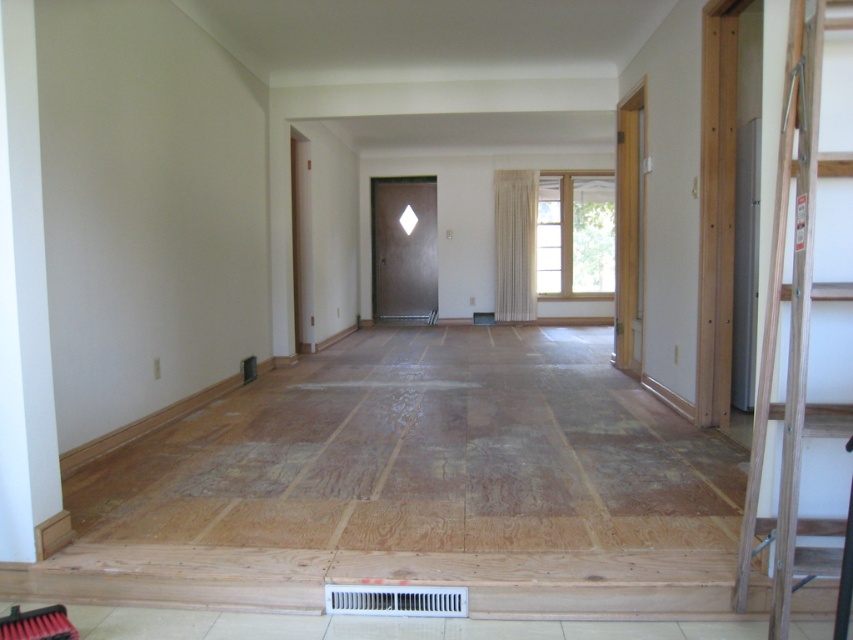
You are a construction worker who needs to move a heavy tool from the wooden ladder at right to the matte dark brown door at center. The tool requires a clear path that is at least 8 meters long. Can you move the tool along the path between them?

The wooden ladder at right and matte dark brown door at center are 9.14 meters apart, so yes, the tool can be moved along the path between them since the distance is sufficient.

You are a delivery person who needs to place a large package in this room. The wooden ladder at right and the white plastic air conditioner at lower center are in the way. Which object should you move first to create space?

You should move the wooden ladder at right first because it is bigger than the white plastic air conditioner at lower center, so moving the larger object first would create more space.

You are a delivery person who needs to place a large package that is 1.5 meters wide in this room. The package must be placed between the matte dark brown door at center and the white plastic air conditioner at lower center. Is there enough space between them to fit the package?

The distance between the matte dark brown door at center and the white plastic air conditioner at lower center is 9.03 meters. Since the package is only 1.5 meters wide, there is sufficient space to place it between them.